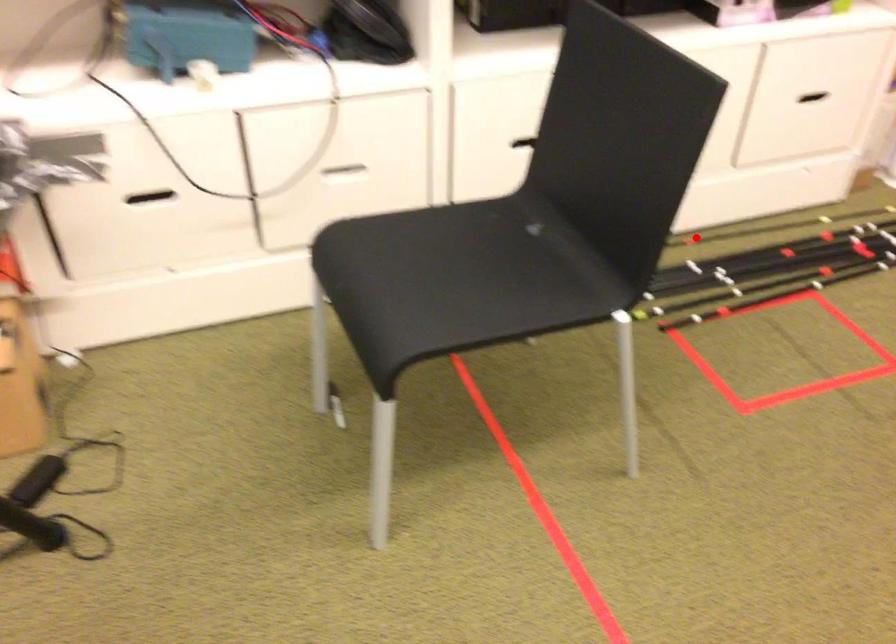
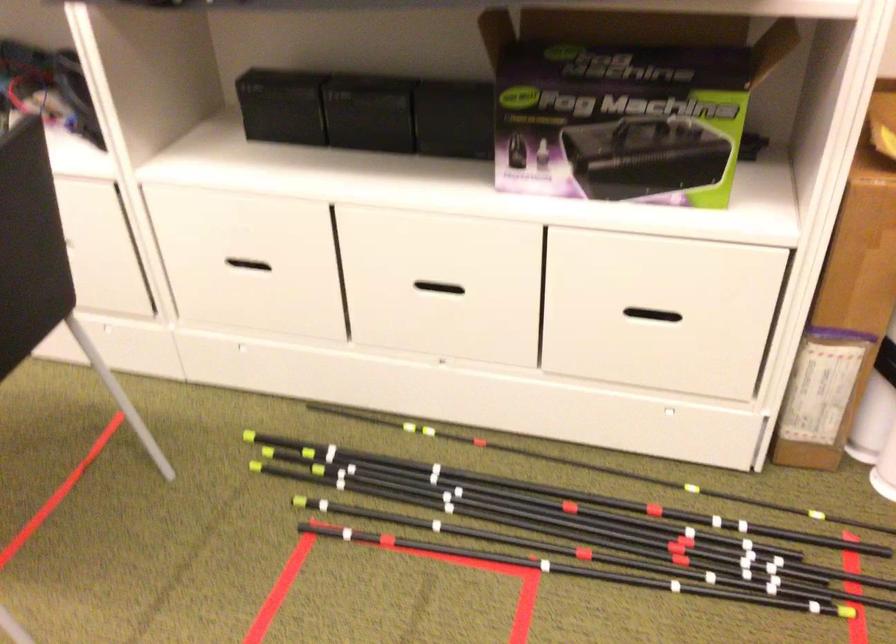
In the second image, find the point that corresponds to the highlighted location in the first image.

(493, 448)